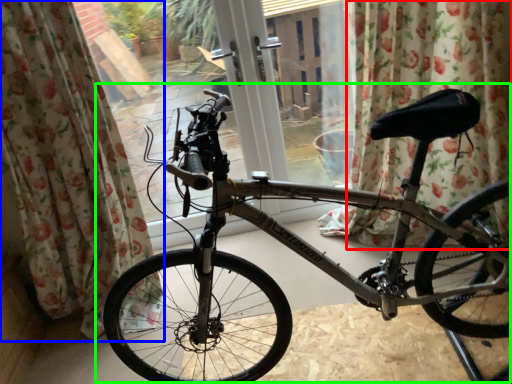
Question: Which object is positioned closest to curtain (highlighted by a red box)? Select from curtain (highlighted by a blue box) and bicycle (highlighted by a green box).

Choices:
 (A) curtain
 (B) bicycle

Answer: (B)